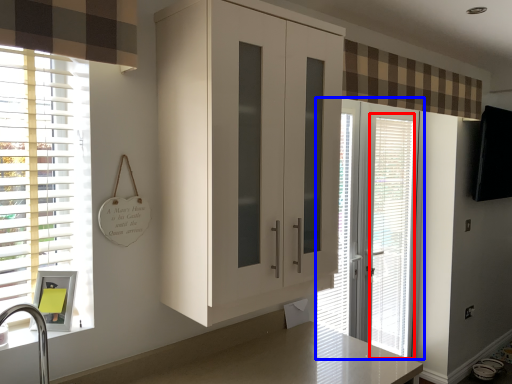
Question: Which object is closer to the camera taking this photo, blind (highlighted by a red box) or door (highlighted by a blue box)?

Choices:
 (A) blind
 (B) door

Answer: (B)